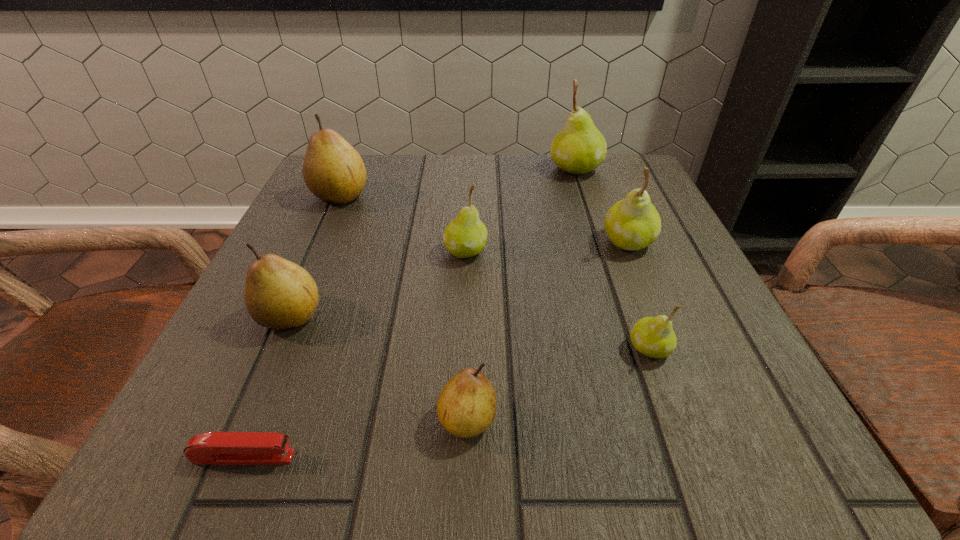
At what (x,y) coordinates should I click in order to perform the action: click on object that can be found as the closest to the farthest brown pear. Please return your answer as a coordinate pair (x, y). This screenshot has height=540, width=960. Looking at the image, I should click on (465, 236).

Identify which pear is the sixth closest to the second nearest brown pear. Please provide its 2D coordinates. Your answer should be formatted as a tuple, i.e. [(x, y)], where the tuple contains the x and y coordinates of a point satisfying the conditions above.

[(580, 147)]

The width and height of the screenshot is (960, 540). I want to click on the sixth closest pear relative to the farthest green pear, so click(466, 407).

Where is `green pear that stands as the second closest to the second smallest green pear`? green pear that stands as the second closest to the second smallest green pear is located at coordinates (653, 337).

The image size is (960, 540). Find the location of `the second closest green pear relative to the shortest object`. the second closest green pear relative to the shortest object is located at coordinates (653, 337).

Find the location of a particular element. The width and height of the screenshot is (960, 540). brown pear identified as the second closest to the leftmost green pear is located at coordinates (333, 170).

You are a GUI agent. You are given a task and a screenshot of the screen. Output one action in this format:
    pyautogui.click(x=<x>, y=<y>)
    Task: Click on the brown pear that is the third closest to the third smallest green pear
    The image size is (960, 540).
    Given the screenshot: What is the action you would take?
    click(x=279, y=294)

At what (x,y) coordinates should I click in order to perform the action: click on free spot that satisfies the following two spatial constraints: 1. on the front side of the second biggest green pear; 2. on the right side of the farthest green pear. Please return your answer as a coordinate pair (x, y). The height and width of the screenshot is (540, 960). Looking at the image, I should click on (600, 241).

Find the location of `vacant area in the image that satisfies the following two spatial constraints: 1. on the back side of the biggest green pear; 2. on the right side of the farthest brown pear`. vacant area in the image that satisfies the following two spatial constraints: 1. on the back side of the biggest green pear; 2. on the right side of the farthest brown pear is located at coordinates (352, 169).

Locate an element on the screen. Image resolution: width=960 pixels, height=540 pixels. vacant region that satisfies the following two spatial constraints: 1. on the back side of the second smallest green pear; 2. on the right side of the second biggest green pear is located at coordinates (467, 241).